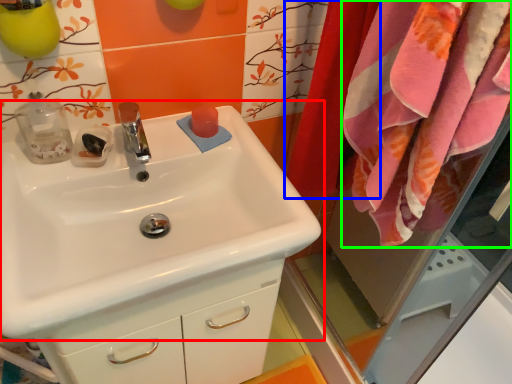
Question: Based on their relative distances, which object is nearer to sink (highlighted by a red box)? Choose from curtain (highlighted by a blue box) and bath towel (highlighted by a green box).

Choices:
 (A) curtain
 (B) bath towel

Answer: (B)